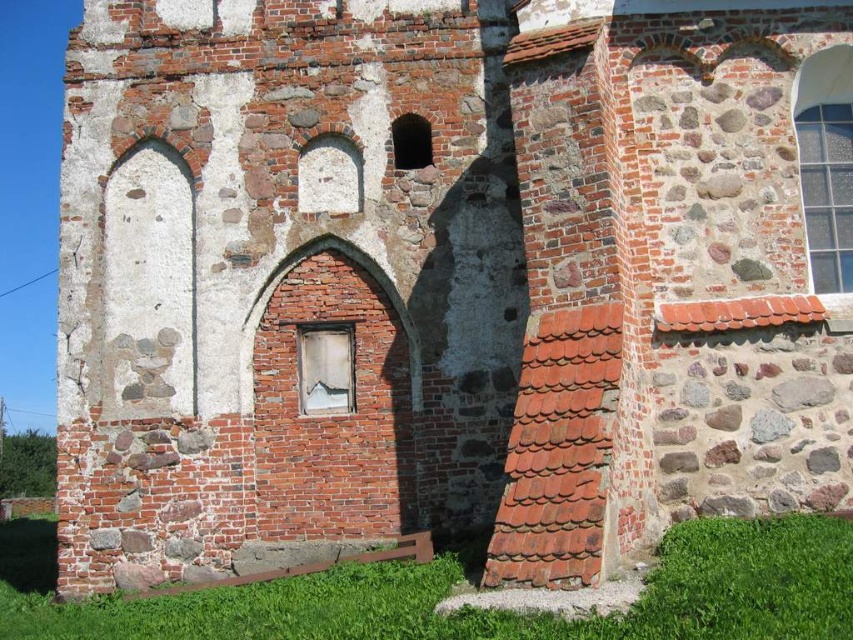
What do you see at coordinates (325, 369) in the screenshot?
I see `transparent glass window at center` at bounding box center [325, 369].

Who is taller, transparent glass window at center or smooth stone arch at center?

With more height is transparent glass window at center.

Measure the distance between transparent glass window at center and camera.

A distance of 40.62 meters exists between transparent glass window at center and camera.

You are a GUI agent. You are given a task and a screenshot of the screen. Output one action in this format:
    pyautogui.click(x=<x>, y=<y>)
    Task: Click on the transparent glass window at center
    This screenshot has height=640, width=853.
    Given the screenshot: What is the action you would take?
    pyautogui.click(x=325, y=369)

Which is above, clear glass window at upper right or smooth stone arch at center?

smooth stone arch at center is higher up.

Between clear glass window at upper right and smooth stone arch at center, which one appears on the left side from the viewer's perspective?

From the viewer's perspective, smooth stone arch at center appears more on the left side.

What do you see at coordinates (827, 193) in the screenshot?
I see `clear glass window at upper right` at bounding box center [827, 193].

This screenshot has height=640, width=853. Identify the location of clear glass window at upper right. (827, 193).

Can you confirm if clear glass window at upper right is positioned above transparent glass window at center?

Yes.

Who is positioned more to the right, clear glass window at upper right or transparent glass window at center?

clear glass window at upper right

Identify the location of clear glass window at upper right. The height and width of the screenshot is (640, 853). (827, 193).

Find the location of a particular element. clear glass window at upper right is located at coordinates (827, 193).